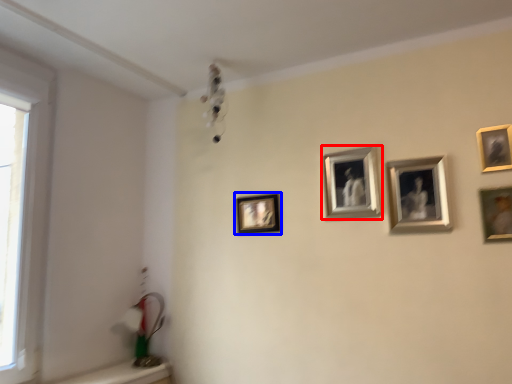
Question: Which point is further to the camera, picture frame (highlighted by a red box) or picture frame (highlighted by a blue box)?

Choices:
 (A) picture frame
 (B) picture frame

Answer: (B)